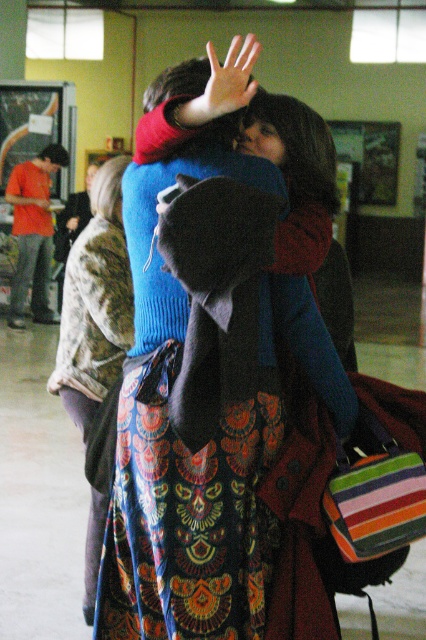
Question: Among these objects, which one is nearest to the camera?

Choices:
 (A) smooth skin hand at center
 (B) matte blue sweater at center

Answer: (A)

Question: Is matte blue sweater at center to the left of floral dress at center from the viewer's perspective?

Choices:
 (A) no
 (B) yes

Answer: (A)

Question: Among these objects, which one is farthest from the camera?

Choices:
 (A) smooth skin hand at center
 (B) matte blue sweater at center
 (C) floral dress at center

Answer: (C)

Question: Among these objects, which one is farthest from the camera?

Choices:
 (A) smooth skin hand at center
 (B) matte blue sweater at center
 (C) floral dress at center

Answer: (C)

Question: Can you confirm if matte blue sweater at center is positioned to the left of floral dress at center?

Choices:
 (A) no
 (B) yes

Answer: (A)

Question: Is floral dress at center bigger than smooth skin hand at center?

Choices:
 (A) yes
 (B) no

Answer: (B)